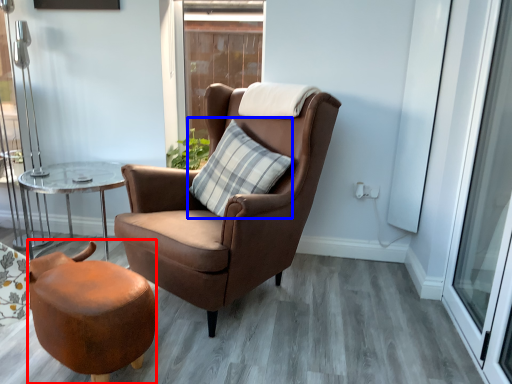
Question: Which object appears closest to the camera in this image, stool (highlighted by a red box) or pillow (highlighted by a blue box)?

Choices:
 (A) stool
 (B) pillow

Answer: (A)